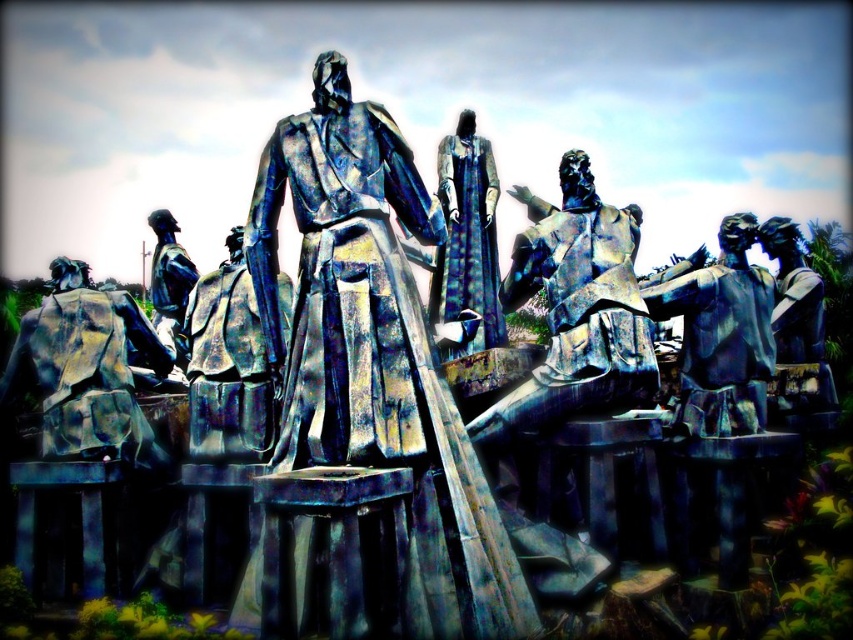
Between point (62, 296) and point (471, 300), which one is positioned behind?

Positioned behind is point (471, 300).

Is brushed metal backpack at lower left to the right of blue-green patina statue at center from the viewer's perspective?

No, brushed metal backpack at lower left is not to the right of blue-green patina statue at center.

This screenshot has height=640, width=853. What are the coordinates of `brushed metal backpack at lower left` in the screenshot? It's located at (86, 371).

Does bronze statue at center have a lesser width compared to shiny bronze statue at right?

In fact, bronze statue at center might be wider than shiny bronze statue at right.

Who is more forward, (346, 176) or (728, 358)?

Point (346, 176) is more forward.

Identify the location of bronze statue at center. [375, 349].

Who is taller, shiny bronze statue at right or blue-green patina statue at center?

Standing taller between the two is blue-green patina statue at center.

Which is in front, point (747, 268) or point (460, 292)?

Point (747, 268)

I want to click on shiny bronze statue at right, so click(x=721, y=337).